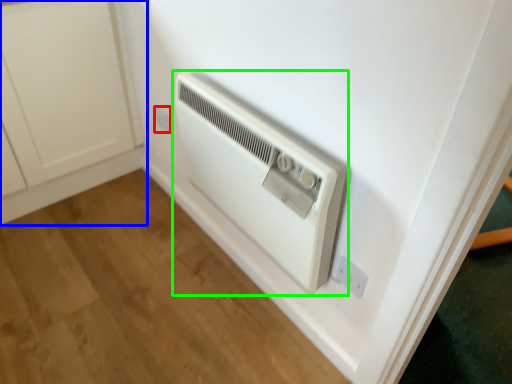
Question: Based on their relative distances, which object is nearer to electric outlet (highlighted by a red box)? Choose from cabinetry (highlighted by a blue box) and home appliance (highlighted by a green box).

Choices:
 (A) cabinetry
 (B) home appliance

Answer: (A)